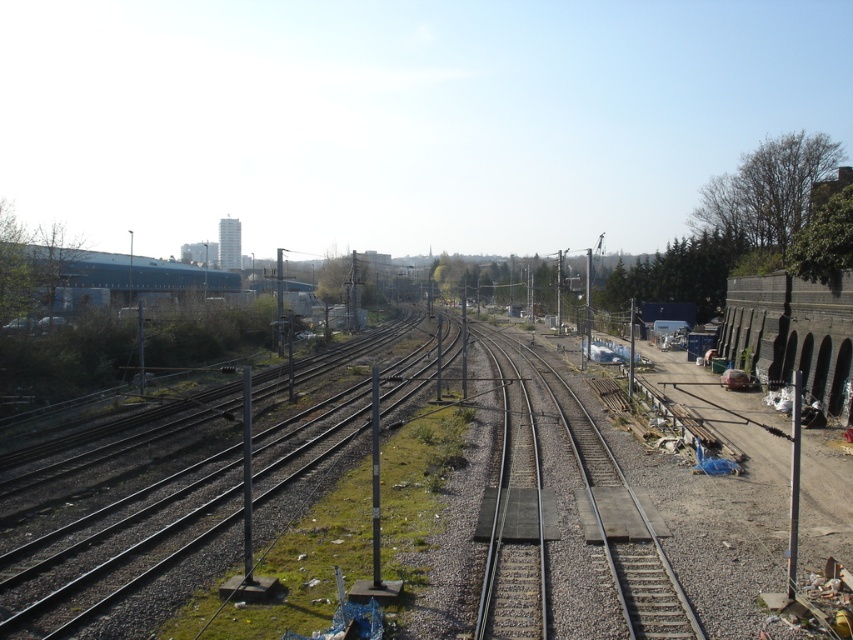
Is point (506, 499) positioned before point (119, 269)?

Yes, point (506, 499) is in front of point (119, 269).

Is point (503, 570) more distant than point (131, 259)?

No, it is not.

The image size is (853, 640). I want to click on smooth steel train track at center, so click(x=566, y=522).

Which of these two, smooth steel train track at center or metallic gray train track at center, stands taller?

Standing taller between the two is metallic gray train track at center.

Is smooth steel train track at center to the left of metallic gray train track at center from the viewer's perspective?

In fact, smooth steel train track at center is to the right of metallic gray train track at center.

Which is behind, point (618, 538) or point (194, 484)?

The point (194, 484) is behind.

The width and height of the screenshot is (853, 640). I want to click on smooth steel train track at center, so click(x=566, y=522).

Is metallic gray train track at center taller than blue matte building at upper left?

Incorrect, metallic gray train track at center's height is not larger of blue matte building at upper left's.

Which is above, metallic gray train track at center or blue matte building at upper left?

blue matte building at upper left is above.

This screenshot has width=853, height=640. Find the location of `metallic gray train track at center`. metallic gray train track at center is located at coordinates (115, 548).

The image size is (853, 640). What are the coordinates of `metallic gray train track at center` in the screenshot? It's located at (115, 548).